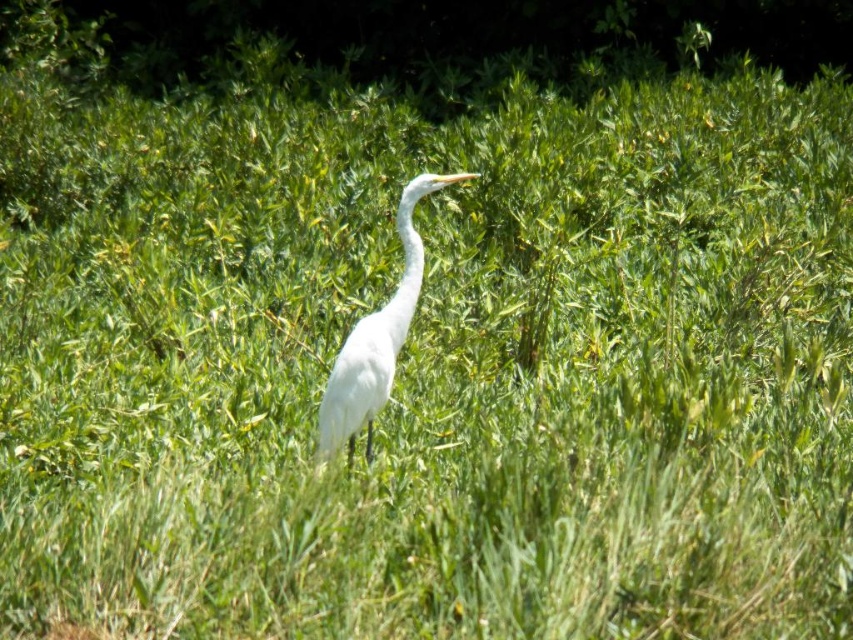
Question: Is white smooth heron at center wider than white smooth neck at center?

Choices:
 (A) no
 (B) yes

Answer: (B)

Question: Which point is farther to the camera?

Choices:
 (A) white smooth heron at center
 (B) white smooth neck at center

Answer: (B)

Question: Among these points, which one is nearest to the camera?

Choices:
 (A) (402, 305)
 (B) (424, 179)

Answer: (B)

Question: Does white smooth heron at center have a smaller size compared to white smooth neck at center?

Choices:
 (A) no
 (B) yes

Answer: (A)

Question: Can you confirm if white smooth heron at center is thinner than white smooth neck at center?

Choices:
 (A) yes
 (B) no

Answer: (B)